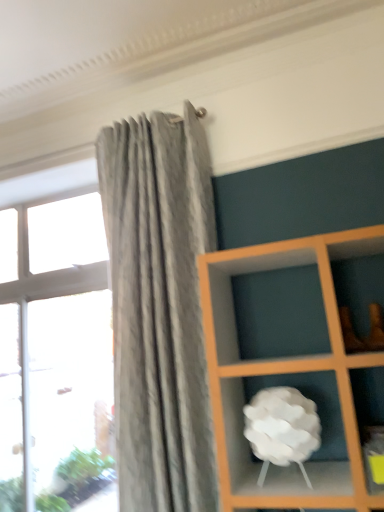
Question: Considering the positions of white matte cloud at center and transparent glass window at left in the image, is white matte cloud at center bigger or smaller than transparent glass window at left?

Choices:
 (A) big
 (B) small

Answer: (B)

Question: Would you say white matte cloud at center is to the left or to the right of transparent glass window at left in the picture?

Choices:
 (A) right
 (B) left

Answer: (A)

Question: Considering the positions of point pyautogui.click(x=230, y=448) and point pyautogui.click(x=84, y=203), is point pyautogui.click(x=230, y=448) closer or farther from the camera than point pyautogui.click(x=84, y=203)?

Choices:
 (A) closer
 (B) farther

Answer: (A)

Question: Does point click(x=49, y=202) appear closer or farther from the camera than point click(x=228, y=452)?

Choices:
 (A) farther
 (B) closer

Answer: (A)

Question: From the image's perspective, is transparent glass window at left located above or below white matte cloud at center?

Choices:
 (A) below
 (B) above

Answer: (A)

Question: Considering the relative positions of transparent glass window at left and white matte cloud at center in the image provided, is transparent glass window at left to the left or to the right of white matte cloud at center?

Choices:
 (A) left
 (B) right

Answer: (A)

Question: In terms of width, does transparent glass window at left look wider or thinner when compared to white matte cloud at center?

Choices:
 (A) wide
 (B) thin

Answer: (B)